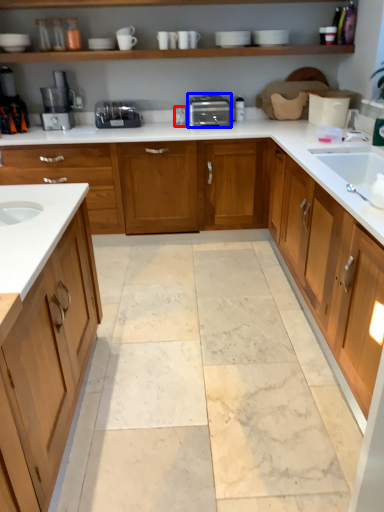
Question: Which object is further to the camera taking this photo, faucet (highlighted by a red box) or toaster (highlighted by a blue box)?

Choices:
 (A) faucet
 (B) toaster

Answer: (A)